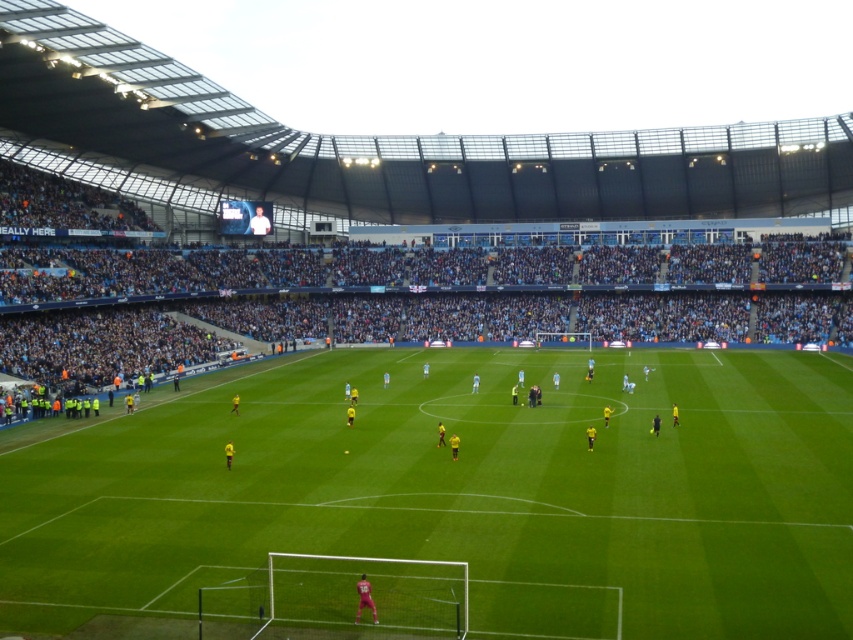
In the scene shown: Can you confirm if green grass football field at center is wider than light blue jersey at center?

No.

Which is below, green grass football field at center or light blue jersey at center?

green grass football field at center is below.

Who is more distant from viewer, (418, 627) or (91, 192)?

The point (91, 192) is behind.

At what (x,y) coordinates should I click in order to perform the action: click on green grass football field at center. Please return your answer as a coordinate pair (x, y). Image resolution: width=853 pixels, height=640 pixels. Looking at the image, I should click on (461, 493).